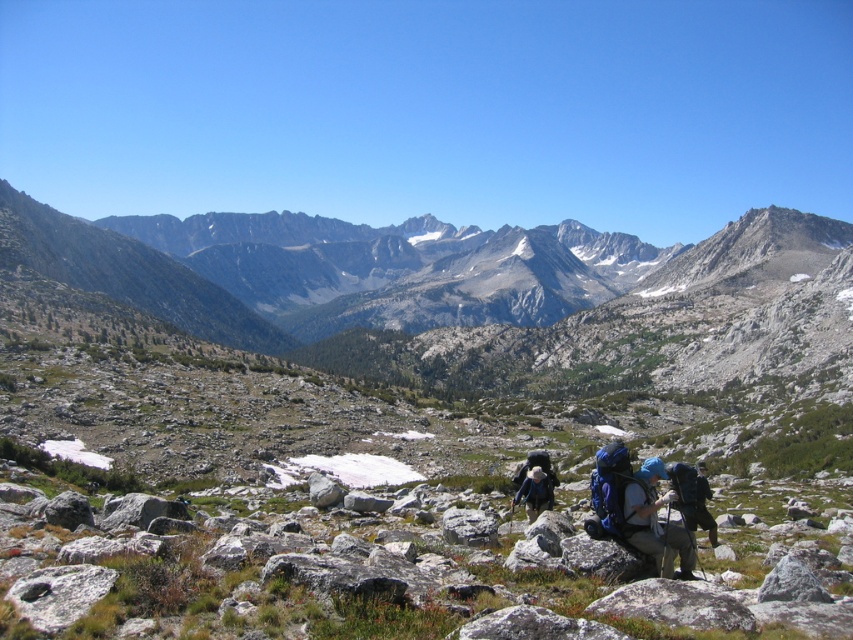
Is rocky terrain at center shorter than gray rough rock at lower left?

In fact, rocky terrain at center may be taller than gray rough rock at lower left.

Who is lower down, rocky terrain at center or gray rough rock at lower left?

gray rough rock at lower left is lower down.

Does point (210, 538) come closer to viewer compared to point (33, 618)?

No, (210, 538) is behind (33, 618).

Locate an element on the screen. This screenshot has height=640, width=853. rocky terrain at center is located at coordinates (401, 435).

Is point (200, 308) in front of point (547, 502)?

No, it is behind (547, 502).

Describe the element at coordinates (376, 268) in the screenshot. The image size is (853, 640). I see `gray rocky mountain range at upper center` at that location.

Who is more distant from viewer, (543, 316) or (527, 509)?

The point (543, 316) is behind.

Locate an element on the screen. This screenshot has height=640, width=853. gray rocky mountain range at upper center is located at coordinates (376, 268).

Is rocky terrain at center below gray rocky mountain range at upper center?

Yes, rocky terrain at center is below gray rocky mountain range at upper center.

Does rocky terrain at center have a smaller size compared to gray rocky mountain range at upper center?

Yes.

Does point (541, 228) come behind point (524, 273)?

Yes, point (541, 228) is behind point (524, 273).

Locate an element on the screen. The image size is (853, 640). rocky terrain at center is located at coordinates (401, 435).